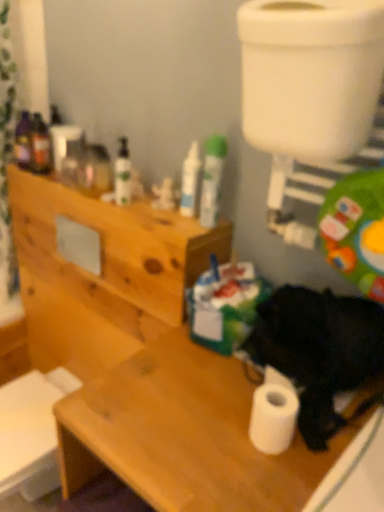
Identify the location of free spot to the left of white glossy tube at upper center, which is counted as the 2th toiletry, starting from the left. (142, 209).